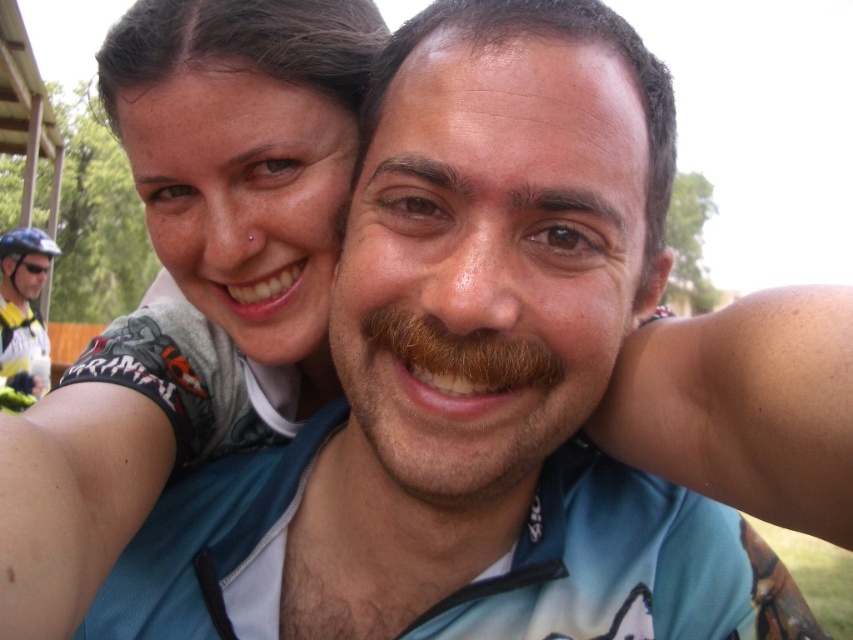
Is matte skin at center positioned at the back of blue matte bicycle helmet at upper left?

No.

Which is behind, point (242, 220) or point (18, 230)?

The point (18, 230) is behind.

Locate an element on the screen. The width and height of the screenshot is (853, 640). matte skin at center is located at coordinates point(193,280).

From the picture: Can you confirm if brown fuzzy mustache at center is thinner than shiny blue helmet at left?

Yes.

Locate an element on the screen. brown fuzzy mustache at center is located at coordinates (465, 376).

Does matte skin at center appear over brown fuzzy mustache at center?

Correct, matte skin at center is located above brown fuzzy mustache at center.

Find the location of a particular element. matte skin at center is located at coordinates (193, 280).

You are a GUI agent. You are given a task and a screenshot of the screen. Output one action in this format:
    pyautogui.click(x=<x>, y=<y>)
    Task: Click on the matte skin at center
    Image resolution: width=853 pixels, height=640 pixels.
    Given the screenshot: What is the action you would take?
    pyautogui.click(x=193, y=280)